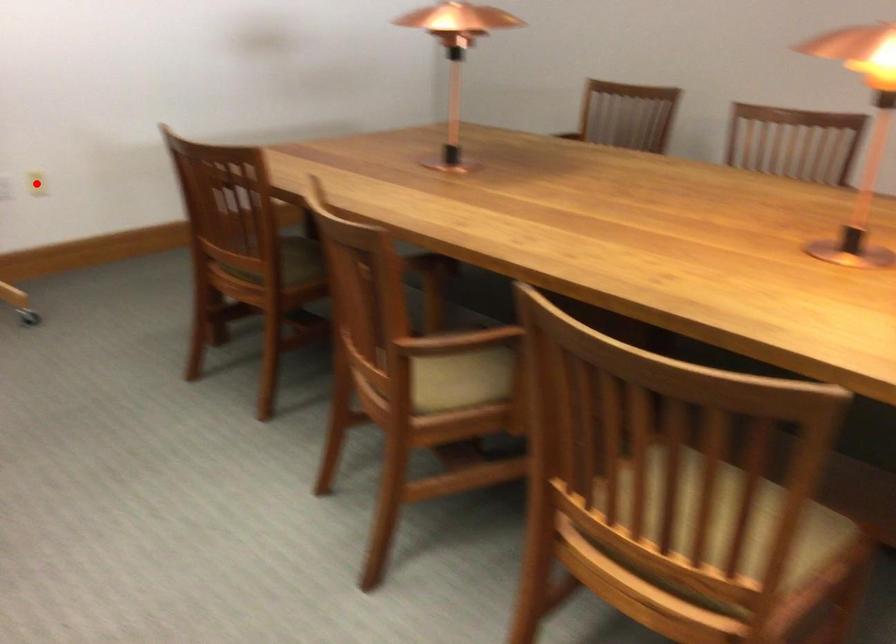
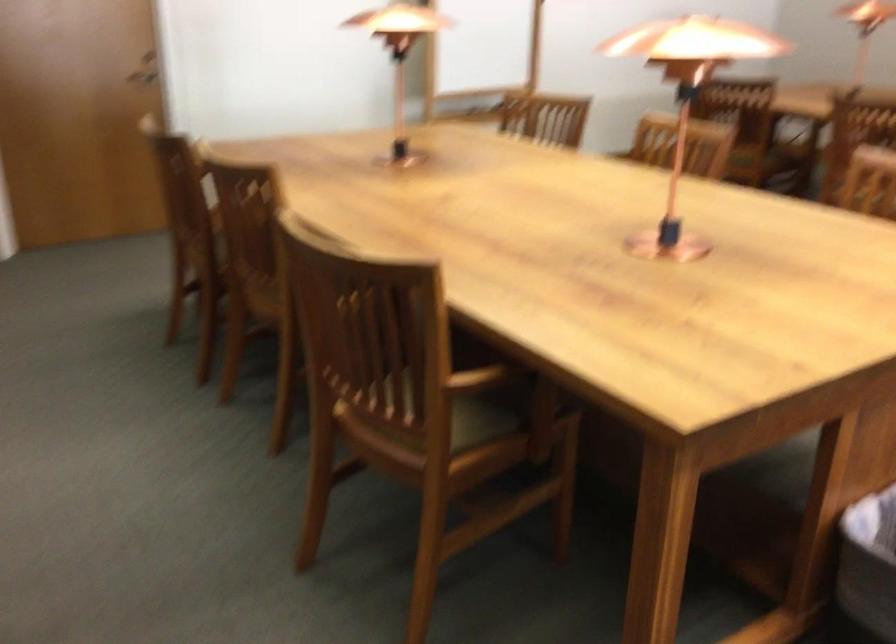
Question: I am providing you with two images of the same scene from different viewpoints. A red point is marked on the first image. At the location where the point appears in image 1, is it still visible in image 2?

Choices:
 (A) Yes
 (B) No

Answer: (B)